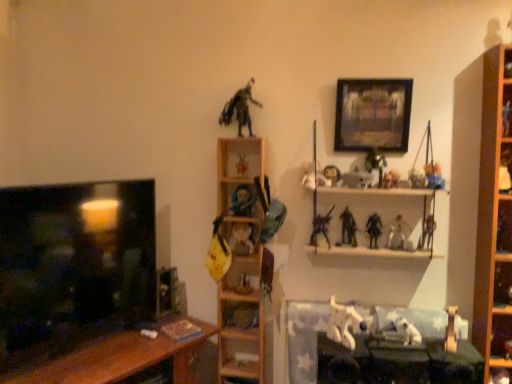
In order to face wooden shelf at center, marked as the 4th shelf in a right-to-left arrangement, should I rotate leftwards or rightwards?

It's best to rotate left around 1.929 degrees.

Identify the location of metallic silver action figure at center, which ranks as the eighth toy in right-to-left order. The width and height of the screenshot is (512, 384). (357, 179).

In the scene shown: How much space does shiny plastic toy at center, which appears as the sixteenth toy when viewed from the right, occupy vertically?

shiny plastic toy at center, which appears as the sixteenth toy when viewed from the right, is 4.23 inches in height.

Find the location of a particular element. Image resolution: width=512 pixels, height=384 pixels. metallic silver action figure at upper center, arranged as the eleventh toy when viewed from the left is located at coordinates (375, 165).

Looking at this image, would you say white matte figurine at upper center, the 12th toy from the right, is part of matte black tv at left's contents?

No.

Who is bigger, matte black tv at left or white matte figurine at upper center, marked as the 6th toy in a left-to-right arrangement?

matte black tv at left is bigger.

Is matte black tv at left aimed at white matte figurine at upper center, marked as the 6th toy in a left-to-right arrangement?

No, matte black tv at left does not turn towards white matte figurine at upper center, marked as the 6th toy in a left-to-right arrangement.

Is the position of matte black tv at left less distant than that of white matte figurine at upper center, the 12th toy from the right?

Yes, the depth of matte black tv at left is less than that of white matte figurine at upper center, the 12th toy from the right.

Can you tell me how much matte black tv at left and shiny metallic figure at upper center, the 7th toy in the left-to-right sequence, differ in facing direction?

The angle between the facing direction of matte black tv at left and the facing direction of shiny metallic figure at upper center, the 7th toy in the left-to-right sequence, is 61.4 degrees.

Between point (31, 228) and point (316, 233), which one is positioned behind?

The point (316, 233) is farther from the camera.

Is matte black tv at left taller than shiny metallic figure at upper center, the 7th toy in the left-to-right sequence?

Indeed, matte black tv at left has a greater height compared to shiny metallic figure at upper center, the 7th toy in the left-to-right sequence.

How far apart are wooden shelf at center, marked as the 4th shelf in a right-to-left arrangement, and wooden shelf at upper center, which ranks as the 2th shelf in right-to-left order?

wooden shelf at center, marked as the 4th shelf in a right-to-left arrangement, and wooden shelf at upper center, which ranks as the 2th shelf in right-to-left order, are 25.95 inches apart from each other.

Can you confirm if wooden shelf at center, marked as the 4th shelf in a right-to-left arrangement, is thinner than wooden shelf at upper center, which ranks as the 2th shelf in right-to-left order?

Indeed, wooden shelf at center, marked as the 4th shelf in a right-to-left arrangement, has a lesser width compared to wooden shelf at upper center, which ranks as the 2th shelf in right-to-left order.

Considering the positions of objects wooden shelf at center, marked as the 4th shelf in a right-to-left arrangement, and wooden shelf at upper center, positioned as the third shelf in left-to-right order, in the image provided, who is more to the right, wooden shelf at center, marked as the 4th shelf in a right-to-left arrangement, or wooden shelf at upper center, positioned as the third shelf in left-to-right order,?

wooden shelf at upper center, positioned as the third shelf in left-to-right order, is more to the right.

Which of these two, wooden shelf at center, arranged as the 1th shelf when viewed from the left, or wooden shelf at upper center, which ranks as the 2th shelf in right-to-left order, is bigger?

wooden shelf at upper center, which ranks as the 2th shelf in right-to-left order.

Locate an element on the screen. The image size is (512, 384). toy that is the 5th object located above the shiny metallic figure at upper center, which appears as the 11th toy when viewed from the right (from the image's perspective) is located at coordinates (357, 179).

How many degrees apart are the facing directions of metallic silver action figure at center, which ranks as the eighth toy in right-to-left order, and shiny metallic figure at upper center, the 7th toy in the left-to-right sequence?

42.3 degrees separate the facing orientations of metallic silver action figure at center, which ranks as the eighth toy in right-to-left order, and shiny metallic figure at upper center, the 7th toy in the left-to-right sequence.

Is metallic silver action figure at center, placed as the tenth toy when sorted from left to right, not near shiny metallic figure at upper center, which appears as the 11th toy when viewed from the right?

metallic silver action figure at center, placed as the tenth toy when sorted from left to right, is actually quite close to shiny metallic figure at upper center, which appears as the 11th toy when viewed from the right.

Consider the image. From the image's perspective, is wooden table at lower center, the first table in the right-to-left sequence, on wooden shelf at right, arranged as the 1th shelf when viewed from the right?

Incorrect, from the image's perspective, wooden table at lower center, the first table in the right-to-left sequence, is lower than wooden shelf at right, arranged as the 1th shelf when viewed from the right.

Which of these two, wooden table at lower center, the first table in the right-to-left sequence, or wooden shelf at right, which appears as the fourth shelf when viewed from the left, is bigger?

wooden shelf at right, which appears as the fourth shelf when viewed from the left.

Is point (436, 379) closer or farther from the camera than point (505, 329)?

Point (436, 379) is positioned closer to the camera compared to point (505, 329).

Would you say wooden table at lower center, the first table in the right-to-left sequence, is inside or outside wooden shelf at right, arranged as the 1th shelf when viewed from the right?

wooden table at lower center, the first table in the right-to-left sequence, is spatially situated outside wooden shelf at right, arranged as the 1th shelf when viewed from the right.

From a real-world perspective, is wooden shelf at upper center, positioned as the third shelf in left-to-right order, above or below shiny plastic toy at center, arranged as the second toy when viewed from the left?

Clearly, from a real-world perspective, wooden shelf at upper center, positioned as the third shelf in left-to-right order, is below shiny plastic toy at center, arranged as the second toy when viewed from the left.

In the scene shown: What's the angular difference between wooden shelf at upper center, positioned as the third shelf in left-to-right order, and shiny plastic toy at center, which appears as the sixteenth toy when viewed from the right,'s facing directions?

0.0045 degrees separate the facing orientations of wooden shelf at upper center, positioned as the third shelf in left-to-right order, and shiny plastic toy at center, which appears as the sixteenth toy when viewed from the right.

From a real-world perspective, which shelf is the 1st one underneath the shiny plastic toy at center, arranged as the second toy when viewed from the left? Please provide its 2D coordinates.

[(379, 194)]

Is point (432, 213) in front of point (240, 155)?

Yes, it is in front of point (240, 155).

Do you think shiny metallic figure at upper center, the 7th toy in the left-to-right sequence, is within metallic silver figure at upper right, which is counted as the sixteenth toy, starting from the left, or outside of it?

shiny metallic figure at upper center, the 7th toy in the left-to-right sequence, is outside metallic silver figure at upper right, which is counted as the sixteenth toy, starting from the left.

Which object is further away from the camera, shiny metallic figure at upper center, which appears as the 11th toy when viewed from the right, or metallic silver figure at upper right, the second toy from the right?

shiny metallic figure at upper center, which appears as the 11th toy when viewed from the right, is more distant.

Looking at this image, would you say shiny metallic figure at upper center, the 7th toy in the left-to-right sequence, is to the left or to the right of metallic silver figure at upper right, which is counted as the sixteenth toy, starting from the left, in the picture?

In the image, shiny metallic figure at upper center, the 7th toy in the left-to-right sequence, appears on the left side of metallic silver figure at upper right, which is counted as the sixteenth toy, starting from the left.

This screenshot has height=384, width=512. Find the location of `entertainment center on the left of the white matte figurine at upper center, the 12th toy from the right`. entertainment center on the left of the white matte figurine at upper center, the 12th toy from the right is located at coordinates (80, 283).

Where is `entertainment center below the shiny metallic figure at upper center, which appears as the 11th toy when viewed from the right (from the image's perspective)`? entertainment center below the shiny metallic figure at upper center, which appears as the 11th toy when viewed from the right (from the image's perspective) is located at coordinates (80, 283).

Estimate the real-world distances between objects in this image. Which object is closer to metallic yellow guitar at center, acting as the 3th toy starting from the left, shiny metallic figure at upper center, the 7th toy in the left-to-right sequence, or wooden picture frame at upper center?

shiny metallic figure at upper center, the 7th toy in the left-to-right sequence, is closer to metallic yellow guitar at center, acting as the 3th toy starting from the left.

Estimate the real-world distances between objects in this image. Which object is further from shiny metallic figure at upper center, the 7th toy in the left-to-right sequence, shiny plastic action figure at upper right, which is the first toy in right-to-left order, or shiny metallic figurine at upper center, which is the 13th toy in right-to-left order?

shiny plastic action figure at upper right, which is the first toy in right-to-left order, is positioned further to the anchor shiny metallic figure at upper center, the 7th toy in the left-to-right sequence.

From the image, which object appears to be nearer to wooden shelf at upper center, which ranks as the 2th shelf in right-to-left order, wooden picture frame at upper center or shiny metallic figure at upper center, which appears as the 11th toy when viewed from the right?

wooden picture frame at upper center.

From the image, which object appears to be nearer to wooden table at lower center, arranged as the 2th table when viewed from the left, matte black tv at left or shiny metallic figurine at center, the fourteenth toy from the right?

shiny metallic figurine at center, the fourteenth toy from the right, is closer to wooden table at lower center, arranged as the 2th table when viewed from the left.

Which object lies further to the anchor point wooden shelf at center, arranged as the 1th shelf when viewed from the left, shiny black figure at upper center, the ninth toy viewed from the right, or shiny plastic action figure at upper right, positioned as the 17th toy in left-to-right order?

shiny plastic action figure at upper right, positioned as the 17th toy in left-to-right order, lies further to wooden shelf at center, arranged as the 1th shelf when viewed from the left, than the other object.

Based on their spatial positions, is matte black tv at left or shiny plastic action figure at upper right, which is the first toy in right-to-left order, further from white matte dog at lower center?

Based on the image, matte black tv at left appears to be further to white matte dog at lower center.

Based on the photo, from the image, which object appears to be nearer to white matte dog at lower center, shiny black figure at upper center, the ninth toy viewed from the right, or brown wooden table at lower left, the first table in the left-to-right sequence?

shiny black figure at upper center, the ninth toy viewed from the right, is closer to white matte dog at lower center.

When comparing their distances from matte plastic action figure at center, which is the 10th toy in right-to-left order, does metallic silver action figure at center, which ranks as the eighth toy in right-to-left order, or shiny metallic figurine at upper center, the 5th toy positioned from the left, seem closer?

metallic silver action figure at center, which ranks as the eighth toy in right-to-left order, is positioned closer to the anchor matte plastic action figure at center, which is the 10th toy in right-to-left order.

In order to click on animal between brown wooden table at lower left, the first table in the left-to-right sequence, and metallic silver figure at center, which is the 4th toy from right to left, in the horizontal direction in this screenshot , I will do `click(344, 324)`.

This screenshot has height=384, width=512. I want to click on animal between shiny metallic figurine at upper center, which is the 13th toy in right-to-left order, and metallic silver action figure at upper right, which appears as the fifteenth toy when viewed from the left, from left to right, so click(344, 324).

Where is `picture frame located between metallic figure at upper center, the seventeenth toy positioned from the right, and wooden shelf at right, which appears as the fourth shelf when viewed from the left, in the left-right direction`? picture frame located between metallic figure at upper center, the seventeenth toy positioned from the right, and wooden shelf at right, which appears as the fourth shelf when viewed from the left, in the left-right direction is located at coordinates (373, 115).

Image resolution: width=512 pixels, height=384 pixels. I want to click on table between metallic figure at upper center, the seventeenth toy positioned from the right, and brown wooden table at lower left, the first table in the left-to-right sequence, in the up-down direction, so click(397, 363).